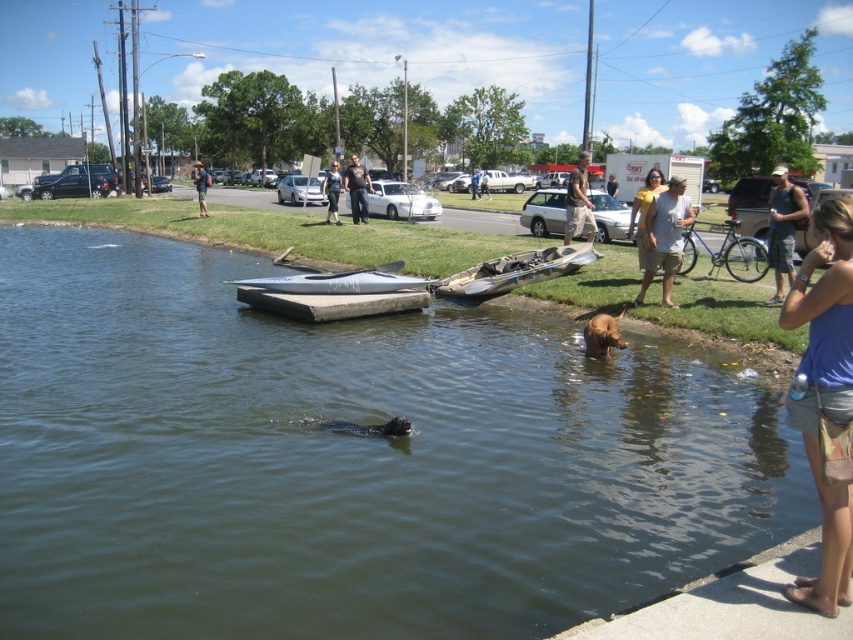
From the picture: You are a photographer trying to capture a photo of the light brown cotton shirt at center and the brown furry dog at lower right. If you want to ensure both subjects are fully visible in the frame without cropping, which subject requires a wider angle lens to accommodate its size?

The light brown cotton shirt at center requires a wider angle lens because its width is larger than the brown furry dog at lower right, necessitating a lens that can capture its broader size without cropping.

Based on the photo, you are a photographer trying to capture the brown furry dog at lower right and the light brown shorts at center in the same frame. Which object should you focus on first to ensure both are in the shot?

The brown furry dog at lower right is shorter than the light brown shorts at center, so you should focus on the light brown shorts at center first to ensure both are in the shot.

You are standing at the center of the image and want to find the light brown cotton shirt at center. According to the coordinates provided, in which direction should you look to locate it?

The light brown cotton shirt at center is located at point 0.372 on the x axis and 0.780 on the y axis, so you should look to the lower left direction from the center to find it.